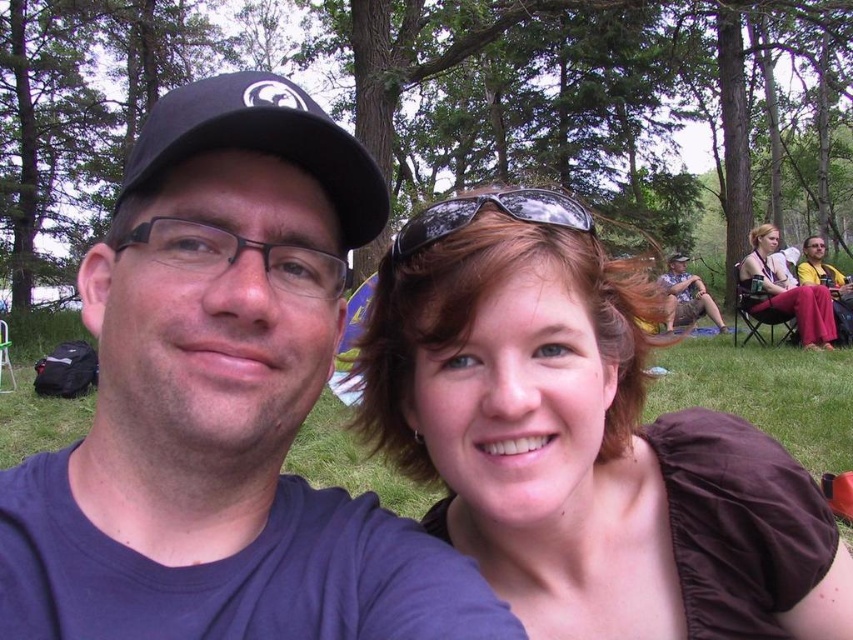
You are standing in the park and see the matte black cap at upper left and the camouflage fabric shirt at center. Which object is positioned lower from your viewpoint?

The matte black cap at upper left is located below the camouflage fabric shirt at center, so it is positioned lower from your viewpoint.